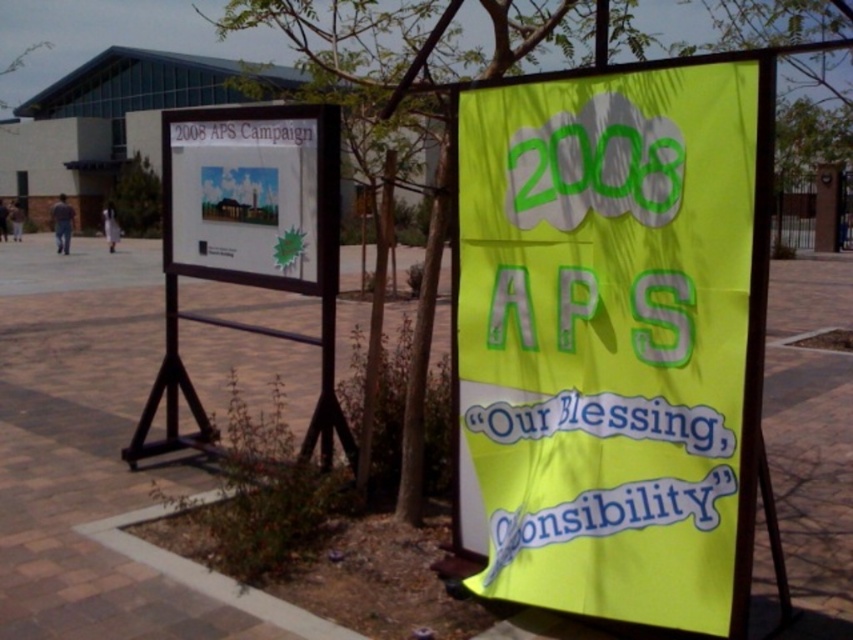
You are standing in a public space and see the yellow paper at center and the white paper poster at upper left. Which one is positioned more to the east? Please answer based on the scene description.

The yellow paper at center is to the right of white paper poster at upper left, so if you are facing the scene, the yellow paper at center would be more to the east since it is positioned to the right of the white paper poster at upper left.

You are an event planner looking to place a new rectangular banner that is 2 meters wide between the white paper poster at upper left and the green leafy tree at center. Based on their widths, can the banner fit between them without overlapping either object?

The white paper poster at upper left has a lesser width compared to green leafy tree at center. Since the banner is 2 meters wide, it depends on the actual space between them. However, the description only mentions their relative widths, not the distance between them. Therefore, we cannot determine if the banner will fit based on the provided information.